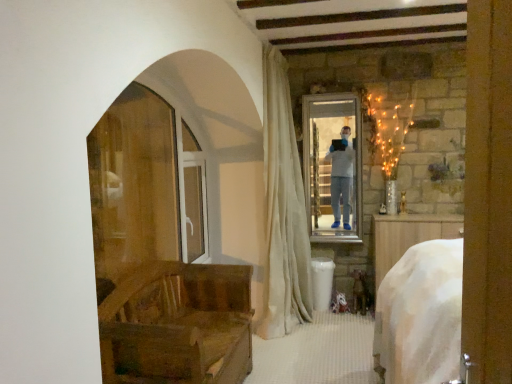
Question: Is white velvet curtain at center with wooden chair at left?

Choices:
 (A) no
 (B) yes

Answer: (A)

Question: Considering the relative sizes of white velvet curtain at center and wooden chair at left in the image provided, is white velvet curtain at center smaller than wooden chair at left?

Choices:
 (A) no
 (B) yes

Answer: (A)

Question: Does white velvet curtain at center have a lesser height compared to wooden chair at left?

Choices:
 (A) yes
 (B) no

Answer: (B)

Question: Considering the relative sizes of white velvet curtain at center and wooden chair at left in the image provided, is white velvet curtain at center taller than wooden chair at left?

Choices:
 (A) yes
 (B) no

Answer: (A)

Question: Considering the relative positions of white velvet curtain at center and wooden chair at left in the image provided, is white velvet curtain at center in front of wooden chair at left?

Choices:
 (A) yes
 (B) no

Answer: (B)

Question: From the image's perspective, is clear glass screen door at center located above or below white velvet curtain at center?

Choices:
 (A) above
 (B) below

Answer: (B)

Question: Choose the correct answer: Is clear glass screen door at center inside white velvet curtain at center or outside it?

Choices:
 (A) outside
 (B) inside

Answer: (A)

Question: From their relative heights in the image, would you say clear glass screen door at center is taller or shorter than white velvet curtain at center?

Choices:
 (A) tall
 (B) short

Answer: (B)

Question: Is clear glass screen door at center wider or thinner than white velvet curtain at center?

Choices:
 (A) thin
 (B) wide

Answer: (A)

Question: From the image's perspective, is white velvet curtain at center positioned above or below wooden chair at left?

Choices:
 (A) below
 (B) above

Answer: (B)

Question: Is point (268, 140) positioned closer to the camera than point (178, 369)?

Choices:
 (A) closer
 (B) farther

Answer: (B)

Question: Is white velvet curtain at center in front of or behind wooden chair at left in the image?

Choices:
 (A) front
 (B) behind

Answer: (B)

Question: In terms of height, does white velvet curtain at center look taller or shorter compared to wooden chair at left?

Choices:
 (A) short
 (B) tall

Answer: (B)

Question: Does point (154, 327) appear closer or farther from the camera than point (276, 208)?

Choices:
 (A) farther
 (B) closer

Answer: (B)

Question: In the image, is wooden chair at left positioned in front of or behind white velvet curtain at center?

Choices:
 (A) front
 (B) behind

Answer: (A)